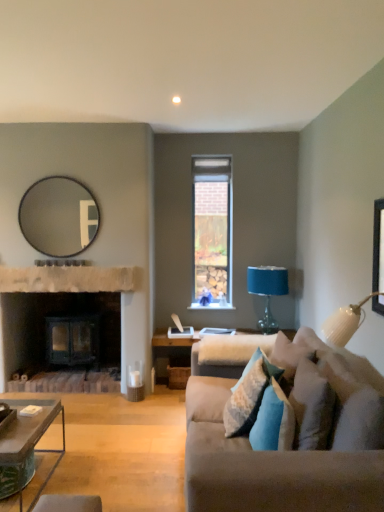
Where is `vacant space to the right of green textured coffee table at lower left`? The width and height of the screenshot is (384, 512). vacant space to the right of green textured coffee table at lower left is located at coordinates (101, 476).